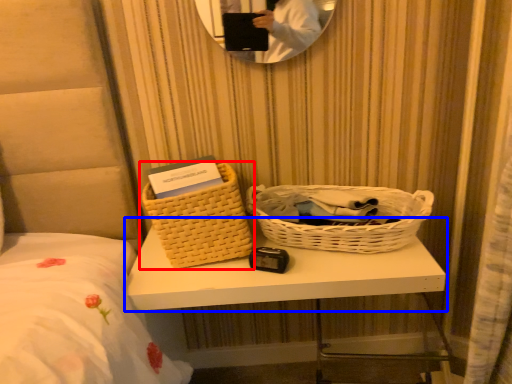
Question: Among these objects, which one is nearest to the camera, picnic basket (highlighted by a red box) or table (highlighted by a blue box)?

Choices:
 (A) picnic basket
 (B) table

Answer: (B)